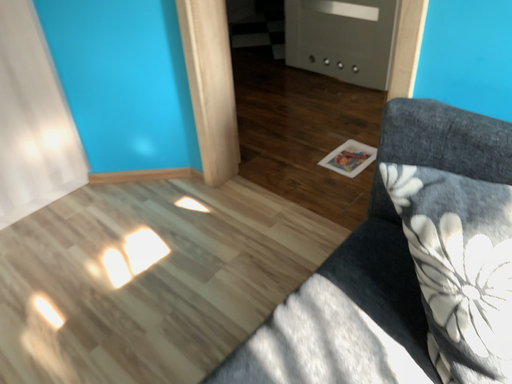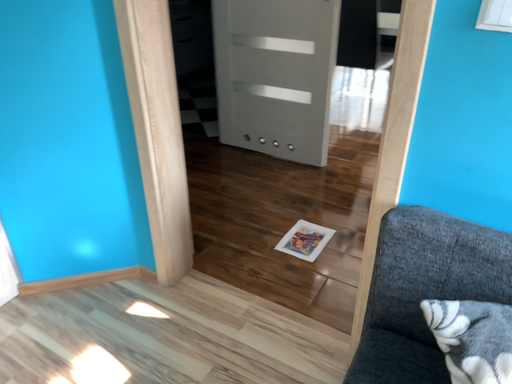
Question: Which way did the camera rotate in the video?

Choices:
 (A) rotated upward
 (B) rotated downward

Answer: (A)